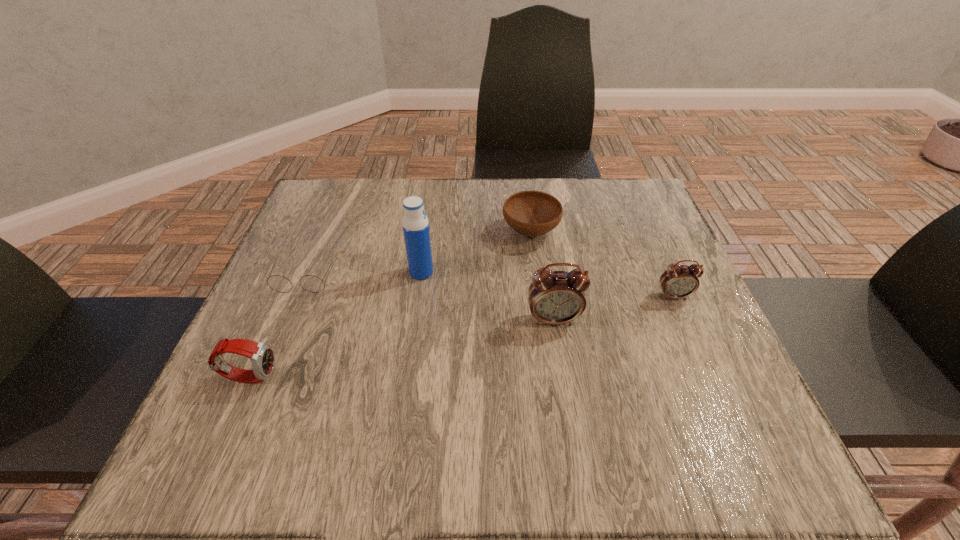
Where is `free space that satisfies the following two spatial constraints: 1. on the face of the left alarm clock; 2. on the face of the nearest object`? free space that satisfies the following two spatial constraints: 1. on the face of the left alarm clock; 2. on the face of the nearest object is located at coordinates (563, 376).